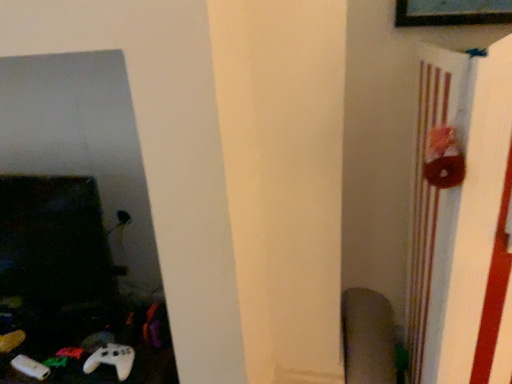
Question: Is point (358, 319) closer or farther from the camera than point (418, 150)?

Choices:
 (A) farther
 (B) closer

Answer: (A)

Question: Would you say velvet-like gray swivel chair at lower right is to the left or to the right of brown fabric bulletin board at right in the picture?

Choices:
 (A) right
 (B) left

Answer: (B)

Question: Estimate the real-world distances between objects in this image. Which object is closer to the white matte game controller at lower left?

Choices:
 (A) brown fabric bulletin board at right
 (B) velvet-like gray swivel chair at lower right

Answer: (B)

Question: Which object is the closest to the velvet-like gray swivel chair at lower right?

Choices:
 (A) white matte game controller at lower left
 (B) brown fabric bulletin board at right

Answer: (B)